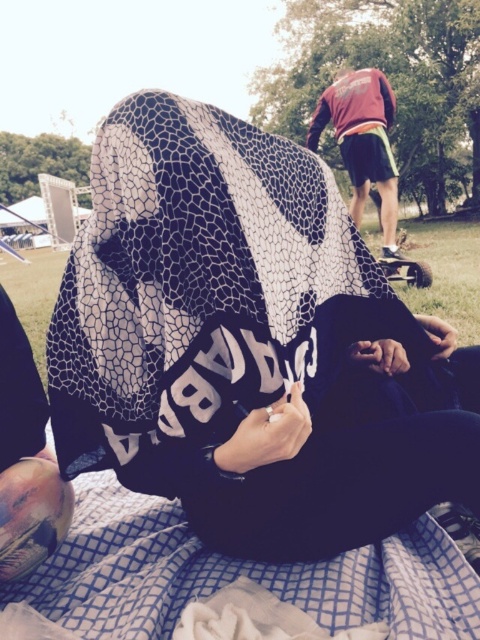
Question: Which object is positioned farthest from the maroon fabric pants at upper right?

Choices:
 (A) blue checkered fabric at lower center
 (B) matte black skateboard at upper right

Answer: (A)

Question: Which is nearer to the metallic silver skateboard at center?

Choices:
 (A) blue checkered fabric at lower center
 (B) matte black skateboard at upper right
 (C) maroon fabric pants at upper right

Answer: (C)

Question: Can you confirm if blue checkered fabric at lower center is smaller than maroon fabric pants at upper right?

Choices:
 (A) yes
 (B) no

Answer: (A)

Question: Estimate the real-world distances between objects in this image. Which object is farther from the maroon fabric pants at upper right?

Choices:
 (A) matte black skateboard at upper right
 (B) blue checkered fabric at lower center

Answer: (B)

Question: Is blue checkered fabric at lower center thinner than maroon fabric pants at upper right?

Choices:
 (A) no
 (B) yes

Answer: (A)

Question: Does matte black skateboard at upper right appear on the left side of blue checkered fabric at lower center?

Choices:
 (A) yes
 (B) no

Answer: (B)